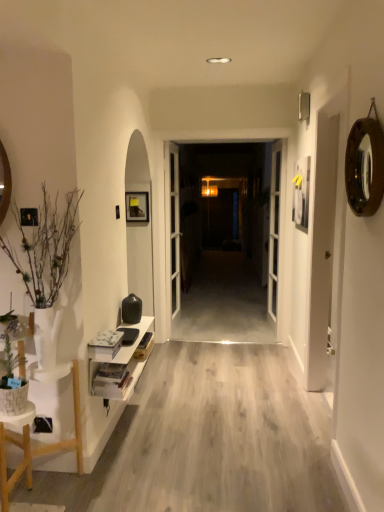
Measure the distance between point (x=178, y=307) and camera.

Point (x=178, y=307) and camera are 4.75 meters apart.

Where is `white glossy shelf at lower left`? This screenshot has height=512, width=384. white glossy shelf at lower left is located at coordinates (118, 367).

Image resolution: width=384 pixels, height=512 pixels. What do you see at coordinates (274, 230) in the screenshot?
I see `white glass door at center, arranged as the 1th door when viewed from the right` at bounding box center [274, 230].

What is the approximate width of white textured stool at lower left?

It is 16.31 inches.

Describe the element at coordinates (46, 266) in the screenshot. This screenshot has width=384, height=512. I see `white matte vase at left` at that location.

This screenshot has width=384, height=512. Find the location of `white matte vase at left`. white matte vase at left is located at coordinates (46, 266).

You are a GUI agent. You are given a task and a screenshot of the screen. Output one action in this format:
    pyautogui.click(x=<x>, y=<y>)
    Task: Click on the transparent glass door at center
    This screenshot has height=512, width=384.
    Given the screenshot: What is the action you would take?
    pyautogui.click(x=225, y=245)

I want to click on white glossy door at center, which appears as the first door when viewed from the left, so click(174, 227).

Considering the relative sizes of white glossy door at center, which appears as the first door when viewed from the left, and white glass door at center, arranged as the 1th door when viewed from the right, in the image provided, is white glossy door at center, which appears as the first door when viewed from the left, thinner than white glass door at center, arranged as the 1th door when viewed from the right,?

Indeed, white glossy door at center, which appears as the first door when viewed from the left, has a lesser width compared to white glass door at center, arranged as the 1th door when viewed from the right.

Could you tell me if white glossy door at center, which appears as the first door when viewed from the left, is facing white glass door at center, arranged as the 1th door when viewed from the right?

No, white glossy door at center, which appears as the first door when viewed from the left, does not turn towards white glass door at center, arranged as the 1th door when viewed from the right.

Is white glossy door at center, marked as the second door in a right-to-left arrangement, not within white glass door at center, the second door positioned from the left?

Absolutely, white glossy door at center, marked as the second door in a right-to-left arrangement, is external to white glass door at center, the second door positioned from the left.

Between white glossy door at center, marked as the second door in a right-to-left arrangement, and white glass door at center, arranged as the 1th door when viewed from the right, which one has more height?

white glass door at center, arranged as the 1th door when viewed from the right, is taller.

Where is `corridor lying on the left of gold metallic mirror at upper right`? The width and height of the screenshot is (384, 512). corridor lying on the left of gold metallic mirror at upper right is located at coordinates (218, 437).

From the image's perspective, does gold metallic mirror at upper right appear higher than light wood floor at center?

Indeed, from the image's perspective, gold metallic mirror at upper right is shown above light wood floor at center.

From a real-world perspective, which is physically above, gold metallic mirror at upper right or light wood floor at center?

From a 3D spatial view, gold metallic mirror at upper right is above.

How different are the orientations of gold metallic mirror at upper right and light wood floor at center in degrees?

0.449 degrees.

Are transparent glass door at center and white textured stool at lower left far apart?

Yes.

From a real-world perspective, is transparent glass door at center positioned under white textured stool at lower left based on gravity?

No, from a real-world perspective, transparent glass door at center is not under white textured stool at lower left.

Is transparent glass door at center positioned with its back to white textured stool at lower left?

transparent glass door at center does not have its back to white textured stool at lower left.

From the image's perspective, is transparent glass door at center located beneath white textured stool at lower left?

No.

You are a GUI agent. You are given a task and a screenshot of the screen. Output one action in this format:
    pyautogui.click(x=<x>, y=<y>)
    Task: Click on the glass door above the white glossy shelf at lower left (from the image's perspective)
    Image resolution: width=384 pixels, height=512 pixels.
    Given the screenshot: What is the action you would take?
    pyautogui.click(x=225, y=245)

Can you confirm if transparent glass door at center is smaller than white glossy shelf at lower left?

Incorrect, transparent glass door at center is not smaller in size than white glossy shelf at lower left.

Between point (175, 331) and point (90, 392), which one is positioned in front?

The point (90, 392) is in front.

In the scene shown: From a real-world perspective, does transparent glass door at center sit lower than white glossy shelf at lower left?

No, from a real-world perspective, transparent glass door at center is not below white glossy shelf at lower left.

How many degrees apart are the facing directions of white glossy door at center, marked as the second door in a right-to-left arrangement, and transparent glass door at center?

The facing directions of white glossy door at center, marked as the second door in a right-to-left arrangement, and transparent glass door at center are 0.000128 degrees apart.

Can you confirm if white glossy door at center, marked as the second door in a right-to-left arrangement, is positioned to the right of transparent glass door at center?

No.

Is white glossy door at center, which appears as the first door when viewed from the left, next to transparent glass door at center?

They are not placed beside each other.

Would you say white glossy shelf at lower left is a long distance from transparent glass door at center?

white glossy shelf at lower left is positioned a significant distance from transparent glass door at center.

Where is `glass door located above the white glossy shelf at lower left (from the image's perspective)`? This screenshot has height=512, width=384. glass door located above the white glossy shelf at lower left (from the image's perspective) is located at coordinates (225, 245).

Measure the distance between white glossy shelf at lower left and transparent glass door at center.

15.45 feet.

Is white glossy shelf at lower left shorter than transparent glass door at center?

Correct, white glossy shelf at lower left is not as tall as transparent glass door at center.

Is white textured stool at lower left positioned with its back to white glossy shelf at lower left?

Absolutely, white textured stool at lower left is directed away from white glossy shelf at lower left.

Would you say white textured stool at lower left is a long distance from white glossy shelf at lower left?

white textured stool at lower left is actually quite close to white glossy shelf at lower left.

From the image's perspective, does white textured stool at lower left appear lower than white glossy shelf at lower left?

Yes.

Is white textured stool at lower left outside of white glossy shelf at lower left?

Absolutely, white textured stool at lower left is external to white glossy shelf at lower left.

This screenshot has width=384, height=512. Identify the location of door that appears above the white glossy door at center, marked as the second door in a right-to-left arrangement (from a real-world perspective). (274, 230).

This screenshot has height=512, width=384. In order to click on oval above the light wood floor at center (from the image's perspective) in this screenshot , I will do `click(365, 167)`.

Looking at the image, which one is located closer to white glossy shelf at lower left, white textured stool at lower left or white glass door at center, arranged as the 1th door when viewed from the right?

white textured stool at lower left is closer to white glossy shelf at lower left.

Which object lies further to the anchor point white textured stool at lower left, white matte vase at left or white glossy shelf at lower left?

white matte vase at left lies further to white textured stool at lower left than the other object.

From the image, which object appears to be farther from white matte vase at left, white textured stool at lower left or white glossy shelf at lower left?

white glossy shelf at lower left is further to white matte vase at left.

From the image, which object appears to be farther from light wood floor at center, white matte vase at left or white glossy shelf at lower left?

The object further to light wood floor at center is white matte vase at left.

When comparing their distances from white glossy shelf at lower left, does white glossy door at center, marked as the second door in a right-to-left arrangement, or white glass door at center, the second door positioned from the left, seem closer?

Based on the image, white glossy door at center, marked as the second door in a right-to-left arrangement, appears to be nearer to white glossy shelf at lower left.

Based on their spatial positions, is white glass door at center, arranged as the 1th door when viewed from the right, or transparent glass door at center further from white glossy shelf at lower left?

transparent glass door at center lies further to white glossy shelf at lower left than the other object.

Which object lies further to the anchor point white textured stool at lower left, white glossy shelf at lower left or light wood floor at center?

light wood floor at center is further to white textured stool at lower left.

Which object lies nearer to the anchor point light wood floor at center, white glossy door at center, marked as the second door in a right-to-left arrangement, or transparent glass door at center?

white glossy door at center, marked as the second door in a right-to-left arrangement, is positioned closer to the anchor light wood floor at center.

Locate an element on the screen. corridor between gold metallic mirror at upper right and white glossy door at center, marked as the second door in a right-to-left arrangement, from front to back is located at coordinates (218, 437).

In order to click on glass door between white glossy shelf at lower left and white glossy door at center, marked as the second door in a right-to-left arrangement, from front to back in this screenshot , I will do `click(225, 245)`.

The width and height of the screenshot is (384, 512). What are the coordinates of `glass door located between white textured stool at lower left and white glossy door at center, which appears as the first door when viewed from the left, in the depth direction` in the screenshot? It's located at pos(225,245).

At what (x,y) coordinates should I click in order to perform the action: click on corridor between white matte vase at left and gold metallic mirror at upper right from left to right. Please return your answer as a coordinate pair (x, y). The height and width of the screenshot is (512, 384). Looking at the image, I should click on (218, 437).